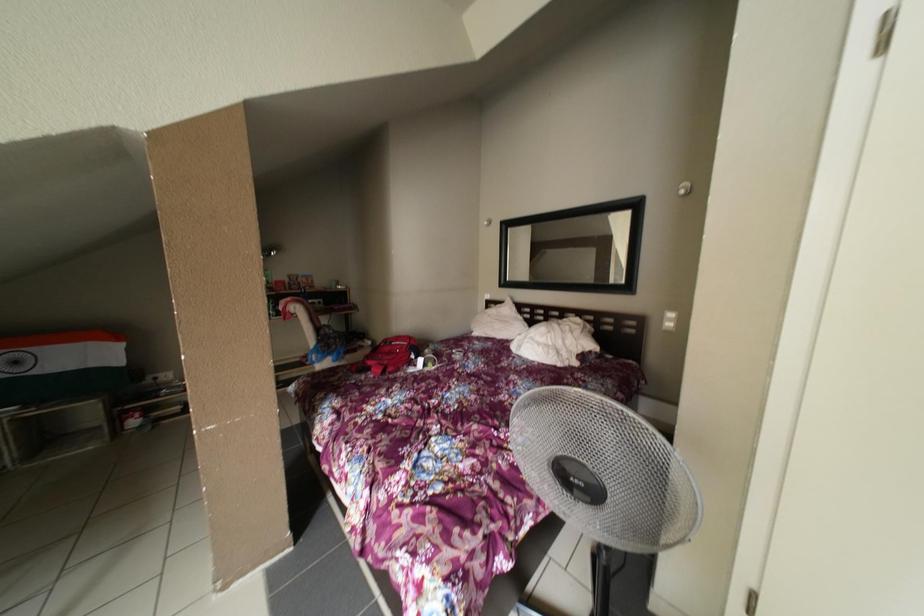
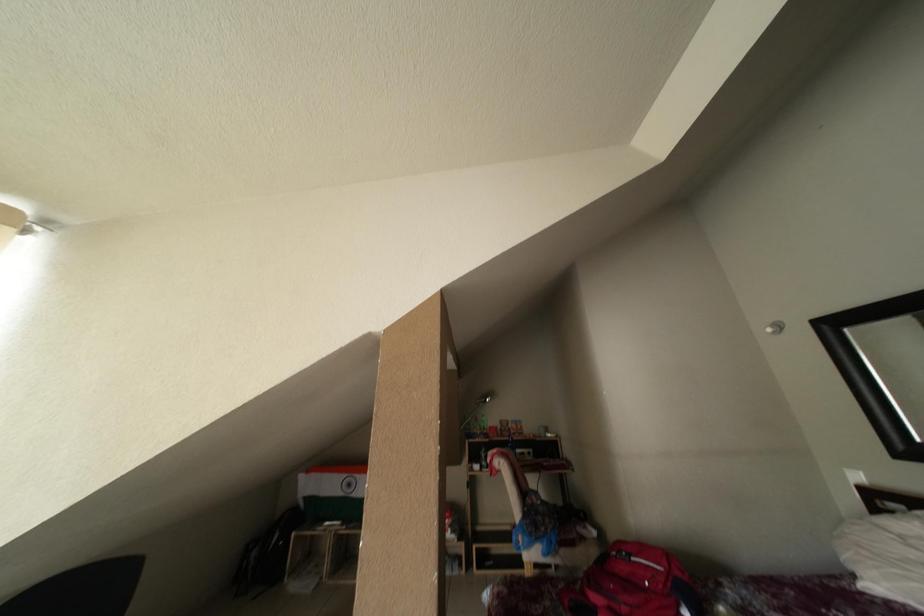
The first image is from the beginning of the video and the second image is from the end. How did the camera likely rotate when shooting the video?

The camera rotated toward left-up.